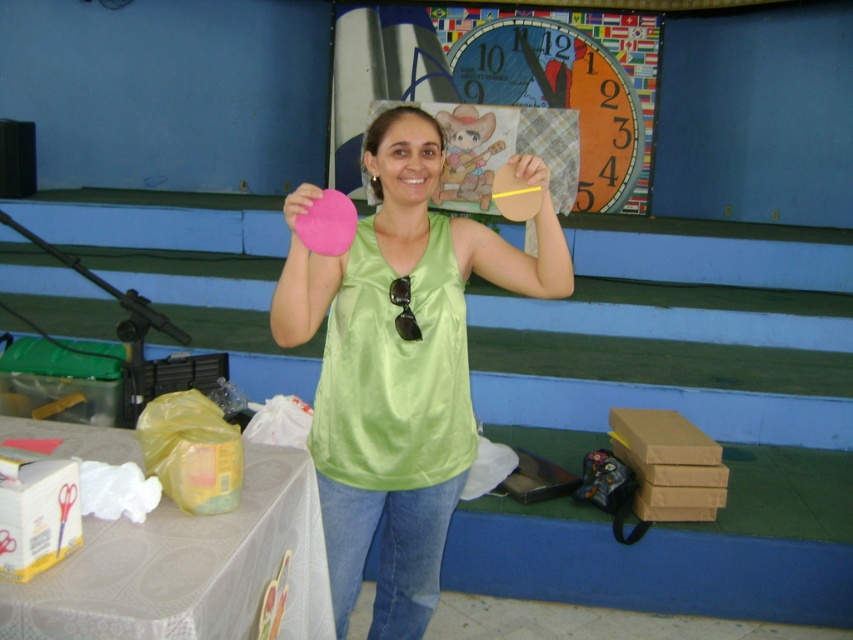
Question: Which point is closer to the camera?

Choices:
 (A) (523, 172)
 (B) (128, 525)

Answer: (B)

Question: Does matte pink heart at center have a larger size compared to white plastic table at lower left?

Choices:
 (A) no
 (B) yes

Answer: (B)

Question: Can you confirm if matte pink heart at center is positioned to the left of white plastic table at lower left?

Choices:
 (A) yes
 (B) no

Answer: (B)

Question: Which of the following is the farthest from the observer?

Choices:
 (A) white plastic table at lower left
 (B) matte pink heart at center

Answer: (B)

Question: Which of the following is the closest to the observer?

Choices:
 (A) matte pink heart at center
 (B) white plastic table at lower left

Answer: (B)

Question: Does matte pink heart at center have a greater width compared to white plastic table at lower left?

Choices:
 (A) no
 (B) yes

Answer: (A)